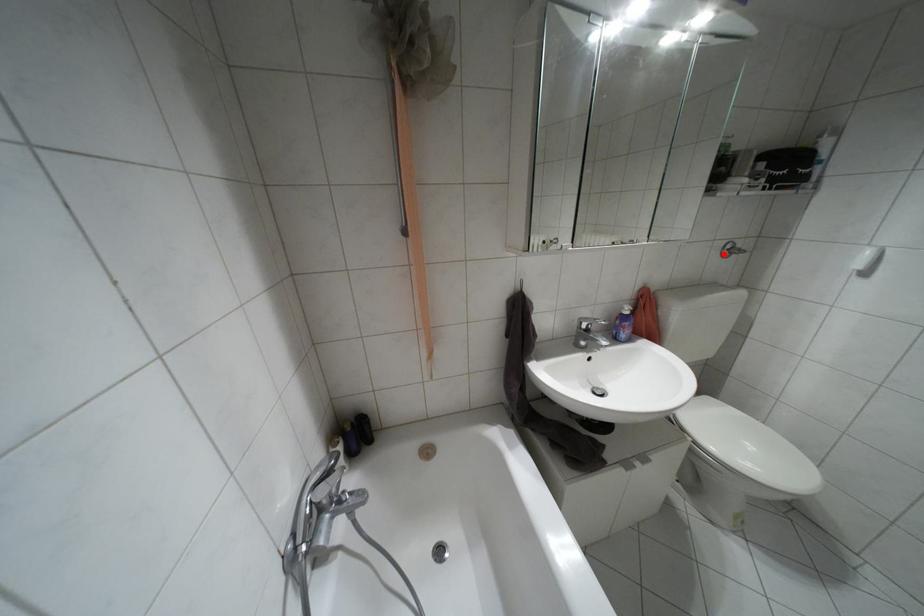
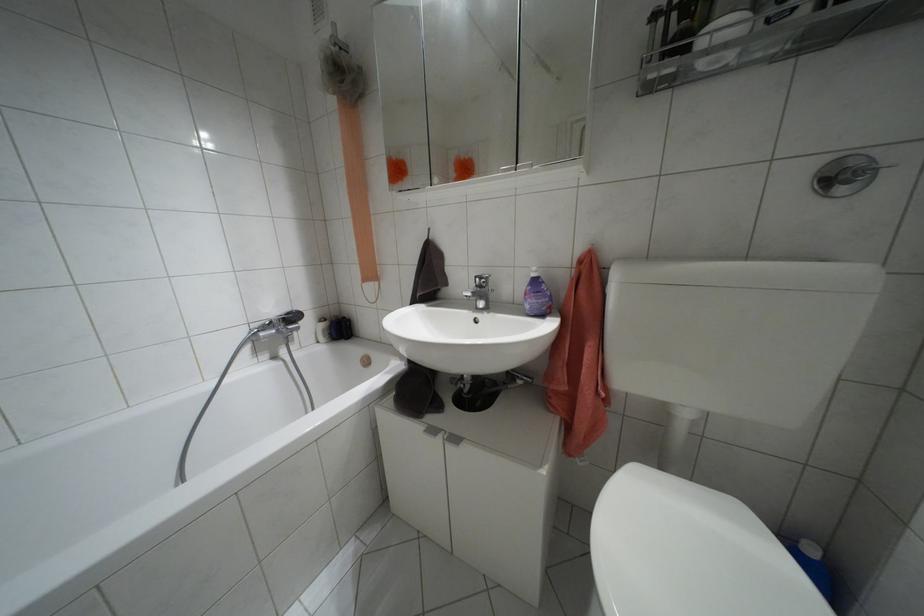
Locate, in the second image, the point that corresponds to the highlighted location in the first image.

(841, 190)